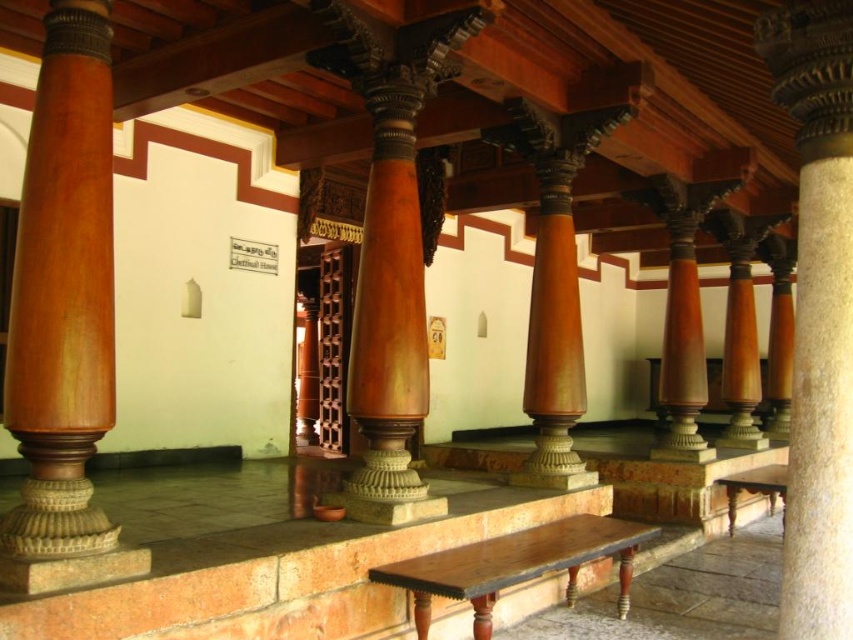
Is mahogany wood column at left wider than wooden polished bench at lower right?

Incorrect, mahogany wood column at left's width does not surpass wooden polished bench at lower right's.

In order to click on mahogany wood column at left in this screenshot , I will do `click(64, 316)`.

Does brown polished stone column at center have a smaller size compared to wooden polished bench at lower right?

Correct, brown polished stone column at center occupies less space than wooden polished bench at lower right.

Can you confirm if brown polished stone column at center is shorter than wooden polished bench at lower right?

Incorrect, brown polished stone column at center's height does not fall short of wooden polished bench at lower right's.

Where is `brown polished stone column at center`? brown polished stone column at center is located at coordinates (817, 314).

The height and width of the screenshot is (640, 853). I want to click on brown polished stone column at center, so click(817, 314).

Is brown polished stone column at center below dark brown wood bench at center?

No, brown polished stone column at center is not below dark brown wood bench at center.

Who is more forward, (848, 192) or (503, 577)?

Point (848, 192) is in front.

Image resolution: width=853 pixels, height=640 pixels. What do you see at coordinates (817, 314) in the screenshot?
I see `brown polished stone column at center` at bounding box center [817, 314].

Identify the location of brown polished stone column at center. Image resolution: width=853 pixels, height=640 pixels. (817, 314).